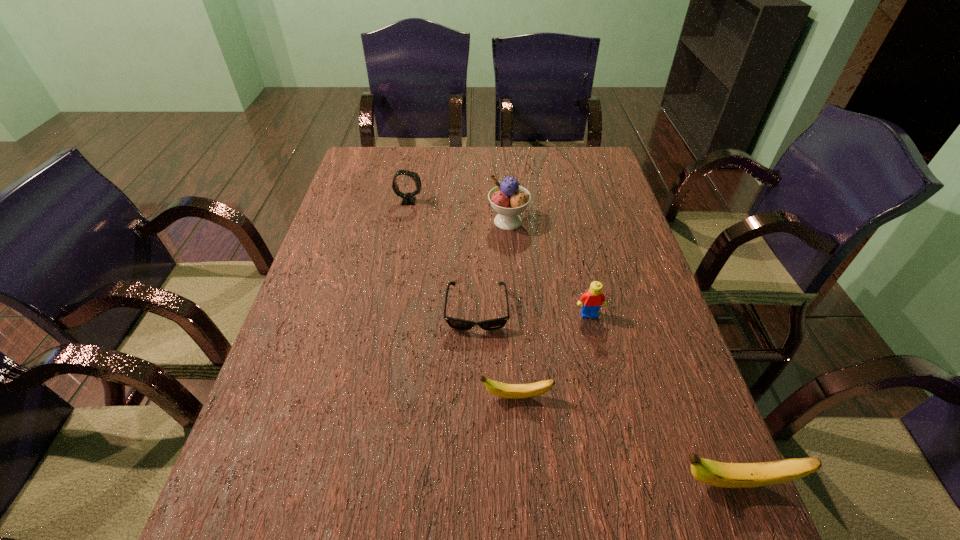
Find the location of a particular element. The image size is (960, 540). the fourth closest object to the taller banana is located at coordinates click(x=508, y=199).

The image size is (960, 540). Find the location of `the second closest object to the watch`. the second closest object to the watch is located at coordinates (455, 323).

Locate an element on the screen. free spot that satisfies the following two spatial constraints: 1. on the face of the leftmost object; 2. on the back side of the tallest object is located at coordinates (405, 221).